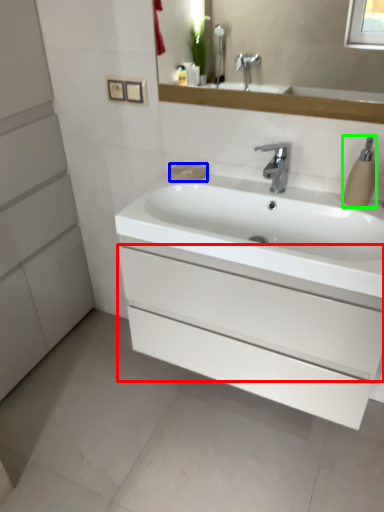
Question: Based on their relative distances, which object is nearer to drawer (highlighted by a red box)? Choose from soap (highlighted by a blue box) and soap dispenser (highlighted by a green box).

Choices:
 (A) soap
 (B) soap dispenser

Answer: (B)